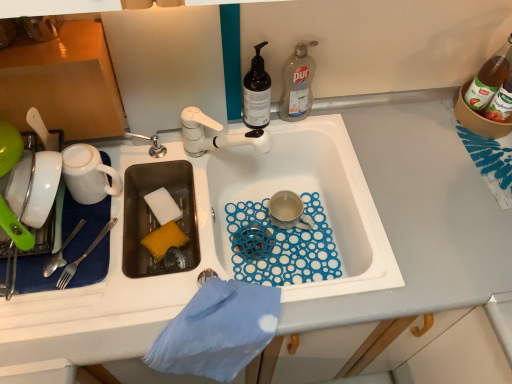
Image resolution: width=512 pixels, height=384 pixels. Identify the location of free spot to the right of satin silver fork at left. (150, 271).